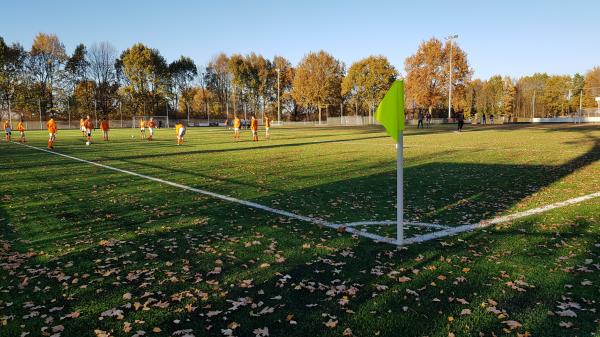
This screenshot has height=337, width=600. I want to click on white corner post, so click(x=404, y=189).